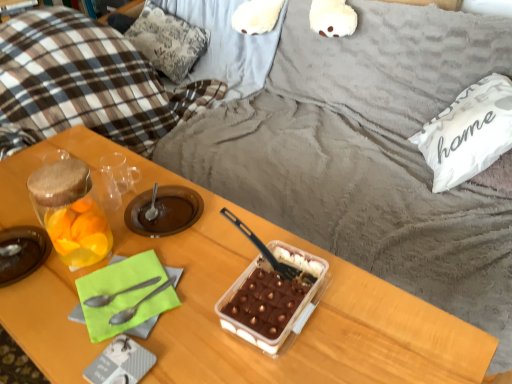
Identify the location of translucent glass jar at left. (22, 252).

The image size is (512, 384). What do you see at coordinates (468, 132) in the screenshot? I see `white fabric pillow at upper right, which is counted as the first pillow, starting from the right` at bounding box center [468, 132].

Measure the distance between point (52,242) and camera.

The depth of point (52,242) is 92.00 centimeters.

In order to face black plastic spoon at center, the third spoon from the left, should I rotate leftwards or rightwards?

Rotate your view right by about 0.041°.

The height and width of the screenshot is (384, 512). What are the coordinates of `translucent glass jar at left` in the screenshot? It's located at (22, 252).

From the image's perspective, is black plastic spoon at center, the third spoon from the left, on plaid fabric pillow at upper left, positioned as the 2th pillow in front-to-back order?

Actually, black plastic spoon at center, the third spoon from the left, appears below plaid fabric pillow at upper left, positioned as the 2th pillow in front-to-back order, in the image.

Could you tell me if black plastic spoon at center, the third spoon from the left, is facing plaid fabric pillow at upper left, the 1th pillow positioned from the top?

No, black plastic spoon at center, the third spoon from the left, is not oriented towards plaid fabric pillow at upper left, the 1th pillow positioned from the top.

Is black plastic spoon at center, the first spoon positioned from the right, with plaid fabric pillow at upper left, which appears as the 2th pillow when viewed from the right?

No, black plastic spoon at center, the first spoon positioned from the right, is not in contact with plaid fabric pillow at upper left, which appears as the 2th pillow when viewed from the right.

From a real-world perspective, is black plastic spoon at center, the third spoon from the left, positioned under plaid fabric pillow at upper left, which appears as the 2th pillow when viewed from the right, based on gravity?

No, from a real-world perspective, black plastic spoon at center, the third spoon from the left, is not beneath plaid fabric pillow at upper left, which appears as the 2th pillow when viewed from the right.

Is translucent plastic tray at center, the 2th snack positioned from the left, surrounded by silver metallic spoon at center, acting as the 2th spoon starting from the right?

No, translucent plastic tray at center, the 2th snack positioned from the left, is not inside silver metallic spoon at center, acting as the 2th spoon starting from the right.

Is silver metallic spoon at center, acting as the 2th spoon starting from the right, looking in the opposite direction of translucent plastic tray at center, the 2th snack positioned from the left?

silver metallic spoon at center, acting as the 2th spoon starting from the right, does not have its back to translucent plastic tray at center, the 2th snack positioned from the left.

Consider the image. Considering the sizes of objects silver metallic spoon at center, the second spoon when ordered from left to right, and translucent plastic tray at center, the 2th snack positioned from the left, in the image provided, who is taller, silver metallic spoon at center, the second spoon when ordered from left to right, or translucent plastic tray at center, the 2th snack positioned from the left,?

Standing taller between the two is translucent plastic tray at center, the 2th snack positioned from the left.

Could you measure the distance between silver metallic spoon at center, acting as the 2th spoon starting from the right, and translucent plastic tray at center, the first snack when ordered from right to left?

silver metallic spoon at center, acting as the 2th spoon starting from the right, and translucent plastic tray at center, the first snack when ordered from right to left, are 8.71 inches apart from each other.

Which is more to the left, wooden table at center or translucent glass jar at left, the first snack in the left-to-right sequence?

Positioned to the left is translucent glass jar at left, the first snack in the left-to-right sequence.

Is wooden table at center further to the viewer compared to translucent glass jar at left, the first snack in the left-to-right sequence?

No, it is in front of translucent glass jar at left, the first snack in the left-to-right sequence.

Which object is wider, wooden table at center or translucent glass jar at left, the first snack in the left-to-right sequence?

wooden table at center.

Could you tell me if wooden table at center is turned towards translucent glass jar at left, the 2th snack viewed from the right?

No, wooden table at center is not turned towards translucent glass jar at left, the 2th snack viewed from the right.

Is translucent glass jar at left facing away from translucent plastic tray at center, the first snack when ordered from right to left?

translucent glass jar at left does not have its back to translucent plastic tray at center, the first snack when ordered from right to left.

Is translucent glass jar at left not near translucent plastic tray at center, the first snack when ordered from right to left?

They are positioned close to each other.

From a real-world perspective, who is located higher, translucent glass jar at left or translucent plastic tray at center, the 2th snack positioned from the left?

translucent plastic tray at center, the 2th snack positioned from the left, from a real-world perspective.

How far apart are plaid fabric pillow at upper left, which is the 1th pillow from back to front, and silver metallic spoon at center, the second spoon when ordered from left to right?

plaid fabric pillow at upper left, which is the 1th pillow from back to front, and silver metallic spoon at center, the second spoon when ordered from left to right, are 4.91 feet apart.

Is plaid fabric pillow at upper left, which appears as the 2th pillow when viewed from the right, facing away from silver metallic spoon at center, the second spoon when ordered from left to right?

plaid fabric pillow at upper left, which appears as the 2th pillow when viewed from the right, does not have its back to silver metallic spoon at center, the second spoon when ordered from left to right.

Could silver metallic spoon at center, acting as the 2th spoon starting from the right, be considered to be inside plaid fabric pillow at upper left, which appears as the 2th pillow when viewed from the right?

No, silver metallic spoon at center, acting as the 2th spoon starting from the right, is not a part of plaid fabric pillow at upper left, which appears as the 2th pillow when viewed from the right.

Between plaid fabric pillow at upper left, which is the 1th pillow from back to front, and silver metallic spoon at center, the second spoon when ordered from left to right, which one appears on the right side from the viewer's perspective?

silver metallic spoon at center, the second spoon when ordered from left to right, is more to the right.

Would you say black plastic spoon at center, the first spoon positioned from the right, is outside translucent glass jar at left, the first snack in the left-to-right sequence?

That's correct, black plastic spoon at center, the first spoon positioned from the right, is outside of translucent glass jar at left, the first snack in the left-to-right sequence.

Measure the distance between black plastic spoon at center, the third spoon from the left, and translucent glass jar at left, the first snack in the left-to-right sequence.

black plastic spoon at center, the third spoon from the left, is 13.35 inches from translucent glass jar at left, the first snack in the left-to-right sequence.

What's the angular difference between black plastic spoon at center, the third spoon from the left, and translucent glass jar at left, the 2th snack viewed from the right,'s facing directions?

0.00683 degrees separate the facing orientations of black plastic spoon at center, the third spoon from the left, and translucent glass jar at left, the 2th snack viewed from the right.

Considering the sizes of black plastic spoon at center, the third spoon from the left, and translucent glass jar at left, the first snack in the left-to-right sequence, in the image, is black plastic spoon at center, the third spoon from the left, wider or thinner than translucent glass jar at left, the first snack in the left-to-right sequence,?

In the image, black plastic spoon at center, the third spoon from the left, appears to be more narrow than translucent glass jar at left, the first snack in the left-to-right sequence.

Find the location of `tableware that appears on the left of wooden table at center`. tableware that appears on the left of wooden table at center is located at coordinates (22, 252).

From the image's perspective, which one is positioned lower, wooden table at center or translucent glass jar at left?

wooden table at center appears lower in the image.

Based on the photo, how far apart are wooden table at center and translucent glass jar at left?

12.41 inches.

Choose the correct answer: Is wooden table at center inside translucent glass jar at left or outside it?

wooden table at center lies outside translucent glass jar at left.

At what (x,y) coordinates should I click in order to perform the action: click on the 3rd spoon to the right of the plaid fabric pillow at upper left, the 1th pillow positioned from the top, starting your count from the anchor. Please return your answer as a coordinate pair (x, y). Image resolution: width=512 pixels, height=384 pixels. Looking at the image, I should click on (269, 252).

In order to click on the 1st snack above the silver metallic spoon at center, the second spoon when ordered from left to right (from the image's perspective) in this screenshot , I will do `click(272, 298)`.

Looking at the image, which one is located closer to plaid fabric pillow at upper left, which is the 1th pillow from back to front, translucent glass jar at left, the 2th snack viewed from the right, or translucent glass jar at left?

Based on the image, translucent glass jar at left, the 2th snack viewed from the right, appears to be nearer to plaid fabric pillow at upper left, which is the 1th pillow from back to front.

Based on their spatial positions, is metallic silver spoon at lower left, acting as the first spoon starting from the left, or translucent glass jar at left closer to plaid fabric pillow at upper left, which is the 1th pillow from back to front?

Among the two, translucent glass jar at left is located nearer to plaid fabric pillow at upper left, which is the 1th pillow from back to front.

Estimate the real-world distances between objects in this image. Which object is further from translucent glass jar at left, the first snack in the left-to-right sequence, plaid fabric pillow at upper left, which appears as the 2th pillow when viewed from the right, or translucent plastic tray at center, the 2th snack positioned from the left?

plaid fabric pillow at upper left, which appears as the 2th pillow when viewed from the right, lies further to translucent glass jar at left, the first snack in the left-to-right sequence, than the other object.

Estimate the real-world distances between objects in this image. Which object is further from plaid fabric pillow at upper left, which appears as the 2th pillow when viewed from the right, translucent glass jar at left or wooden table at center?

translucent glass jar at left is positioned further to the anchor plaid fabric pillow at upper left, which appears as the 2th pillow when viewed from the right.

Estimate the real-world distances between objects in this image. Which object is further from translucent glass jar at left, white fabric pillow at upper right, which is the first pillow from bottom to top, or wooden table at center?

Among the two, white fabric pillow at upper right, which is the first pillow from bottom to top, is located further to translucent glass jar at left.

When comparing their distances from white fabric pillow at upper right, which is the 2th pillow in left-to-right order, does wooden table at center or translucent plastic tray at center, the 2th snack positioned from the left, seem closer?

The object closer to white fabric pillow at upper right, which is the 2th pillow in left-to-right order, is translucent plastic tray at center, the 2th snack positioned from the left.

Considering their positions, is metallic silver spoon at lower left, acting as the first spoon starting from the left, positioned further to plaid fabric pillow at upper left, which is the 1th pillow from back to front, than translucent glass jar at left, the first snack in the left-to-right sequence?

metallic silver spoon at lower left, acting as the first spoon starting from the left, lies further to plaid fabric pillow at upper left, which is the 1th pillow from back to front, than the other object.

From the image, which object appears to be farther from black plastic spoon at center, the first spoon positioned from the right, metallic silver spoon at lower left, the 3th spoon from the right, or plaid fabric pillow at upper left, positioned as the 2th pillow in front-to-back order?

plaid fabric pillow at upper left, positioned as the 2th pillow in front-to-back order, is further to black plastic spoon at center, the first spoon positioned from the right.

At what (x,y) coordinates should I click in order to perform the action: click on tableware located between wooden table at center and plaid fabric pillow at upper left, positioned as the 2th pillow in front-to-back order, in the depth direction. Please return your answer as a coordinate pair (x, y). This screenshot has width=512, height=384. Looking at the image, I should click on (22, 252).

Where is `desk situated between translucent glass jar at left and translucent plastic tray at center, the 2th snack positioned from the left, from left to right`? The height and width of the screenshot is (384, 512). desk situated between translucent glass jar at left and translucent plastic tray at center, the 2th snack positioned from the left, from left to right is located at coordinates (241, 272).

Identify the location of tableware located between metallic silver spoon at lower left, the 3th spoon from the right, and plaid fabric pillow at upper left, the 2th pillow when ordered from bottom to top, in the depth direction. This screenshot has width=512, height=384. (22, 252).

In order to click on snack between wooden table at center and white fabric pillow at upper right, which is the first pillow from bottom to top, from left to right in this screenshot , I will do `click(272, 298)`.